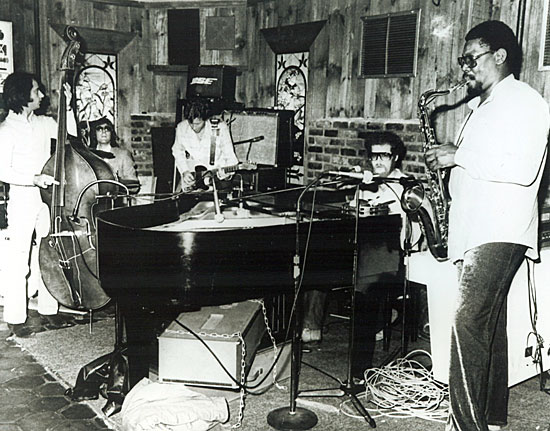
In order to click on vent in this screenshot , I will do `click(400, 41)`.